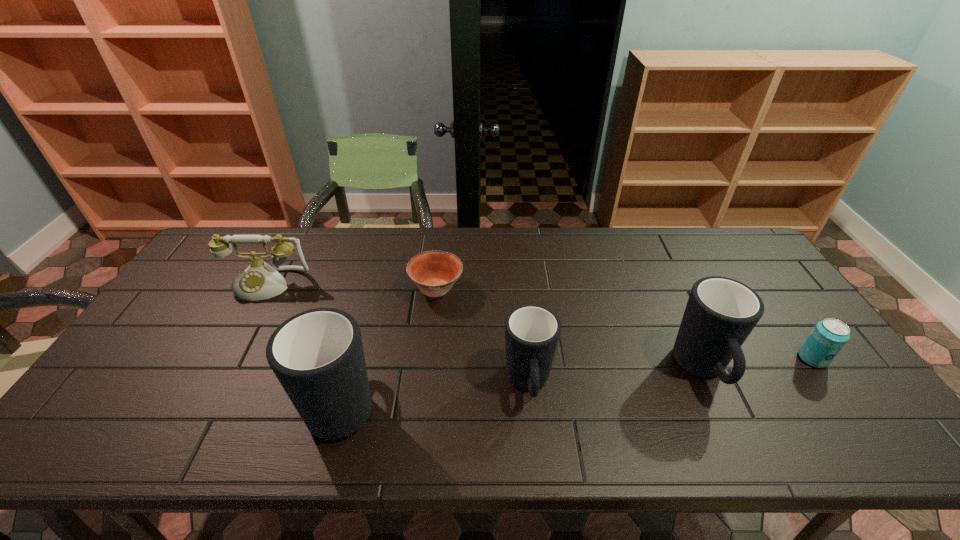
All mugs are currently evenly spaced. To continue this pattern, where would you add another mug on the left? Please point out a vacant spot. Please provide its 2D coordinates. Your answer should be formatted as a tuple, i.e. [(x, y)], where the tuple contains the x and y coordinates of a point satisfying the conditions above.

[(149, 414)]